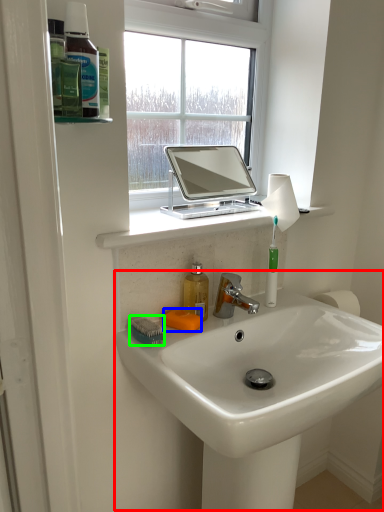
Question: Which object is positioned closest to sink (highlighted by a red box)? Select from soap (highlighted by a blue box) and brush (highlighted by a green box).

Choices:
 (A) soap
 (B) brush

Answer: (A)